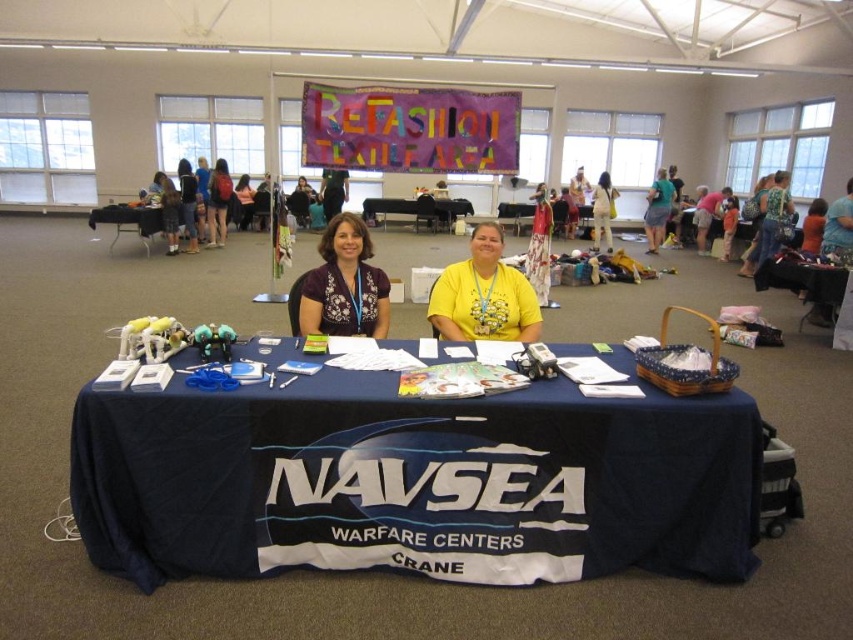
What is located at the point with coordinates (218, 202) in the image?

The point with coordinates (218, 202) is on a matte black backpack at center.

You are organizing a textile recycling workshop and need to place a new item on the table. The table has a dark blue tablecloth with the NAVSEA Warfare Centers Crane logo. Where is the matte purple blouse at center currently positioned on the table?

The matte purple blouse at center is located at point (344, 284) on the table.